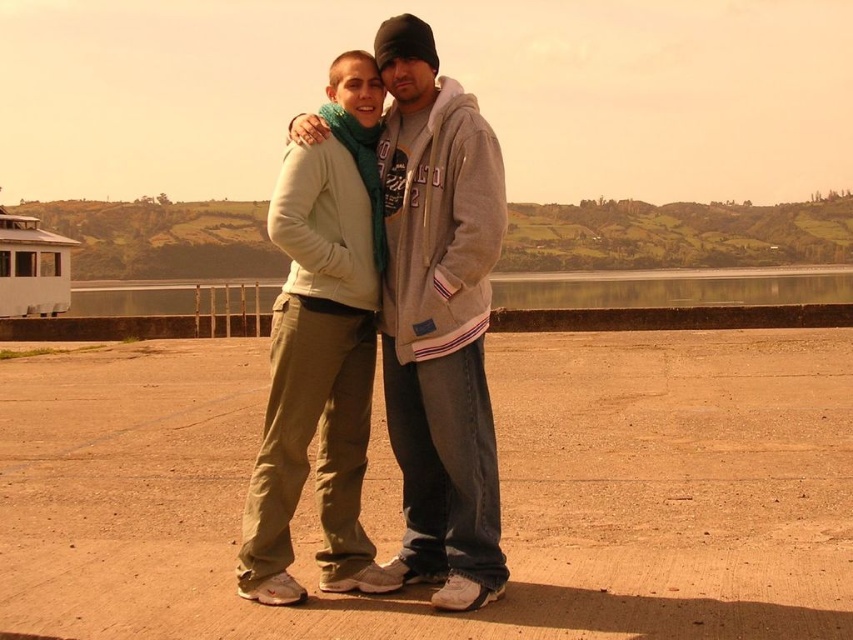
Question: Which point is farther to the camera?

Choices:
 (A) transparent glass water at center
 (B) matte gray hoodie at center

Answer: (A)

Question: Among these points, which one is farthest from the camera?

Choices:
 (A) (769, 280)
 (B) (457, 356)

Answer: (A)

Question: Can you confirm if matte gray hoodie at center is positioned to the left of transparent glass water at center?

Choices:
 (A) no
 (B) yes

Answer: (B)

Question: Which point appears farthest from the camera in this image?

Choices:
 (A) (216, 289)
 (B) (416, 332)

Answer: (A)

Question: Does matte gray hoodie at center appear on the right side of transparent glass water at center?

Choices:
 (A) yes
 (B) no

Answer: (B)

Question: Does matte gray hoodie at center lie in front of transparent glass water at center?

Choices:
 (A) yes
 (B) no

Answer: (A)